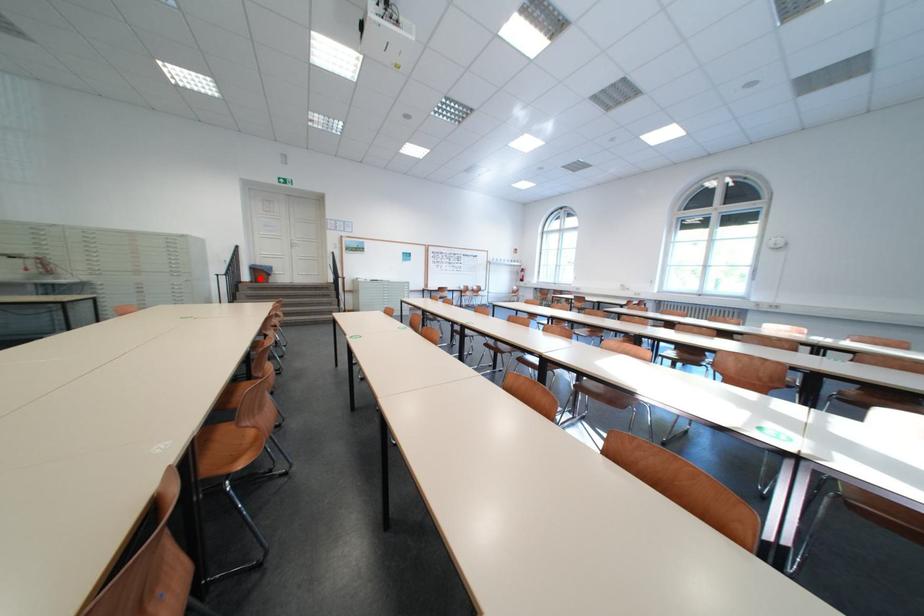
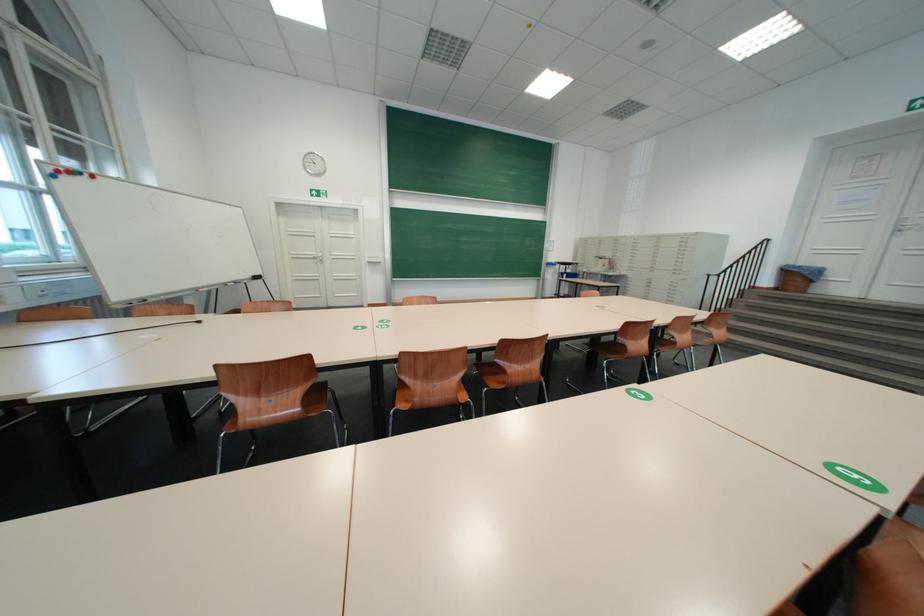
Locate, in the second image, the point that corresponds to the highlighted location in the first image.

(781, 283)